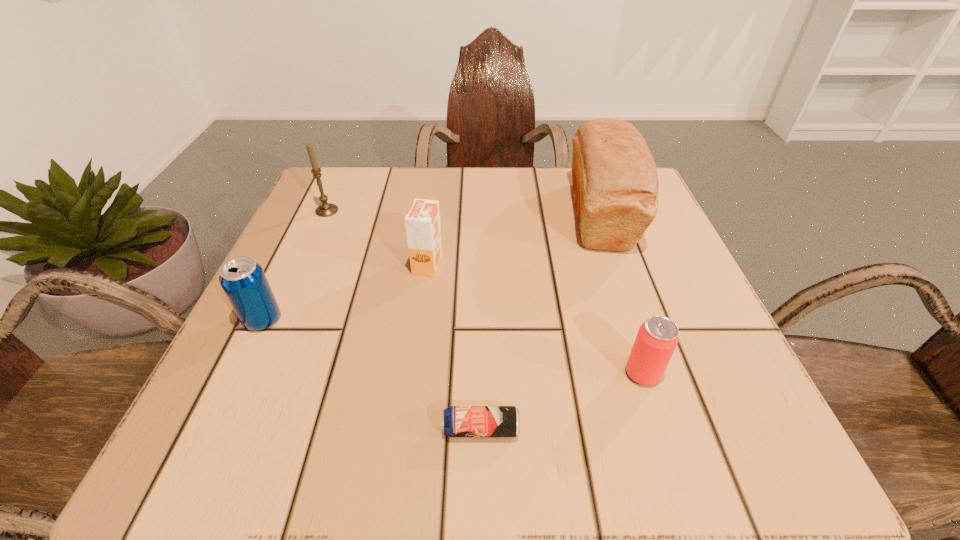
Where is `vacant area situated on the back of the orange juice`? This screenshot has height=540, width=960. vacant area situated on the back of the orange juice is located at coordinates (435, 210).

Image resolution: width=960 pixels, height=540 pixels. I want to click on free space located 0.220m on the right of the fourth farthest object, so click(420, 319).

You are a GUI agent. You are given a task and a screenshot of the screen. Output one action in this format:
    pyautogui.click(x=<x>, y=<y>)
    Task: Click on the vacant area located on the back of the taller beer can
    The width and height of the screenshot is (960, 540).
    Given the screenshot: What is the action you would take?
    pyautogui.click(x=593, y=219)

Find the location of a particular element. The height and width of the screenshot is (540, 960). free region located on the back of the third object from right to left is located at coordinates (481, 265).

What are the coordinates of `bread that is at the far edge` in the screenshot? It's located at (615, 184).

This screenshot has height=540, width=960. I want to click on candle at the far edge, so click(x=325, y=209).

I want to click on object at the near edge, so [x=458, y=421].

The height and width of the screenshot is (540, 960). I want to click on candle that is positioned at the left edge, so click(325, 209).

The image size is (960, 540). Find the location of `pop soda that is at the left edge`. pop soda that is at the left edge is located at coordinates tap(243, 280).

Find the location of a particular element. Image resolution: width=960 pixels, height=540 pixels. bread located at the right edge is located at coordinates (615, 184).